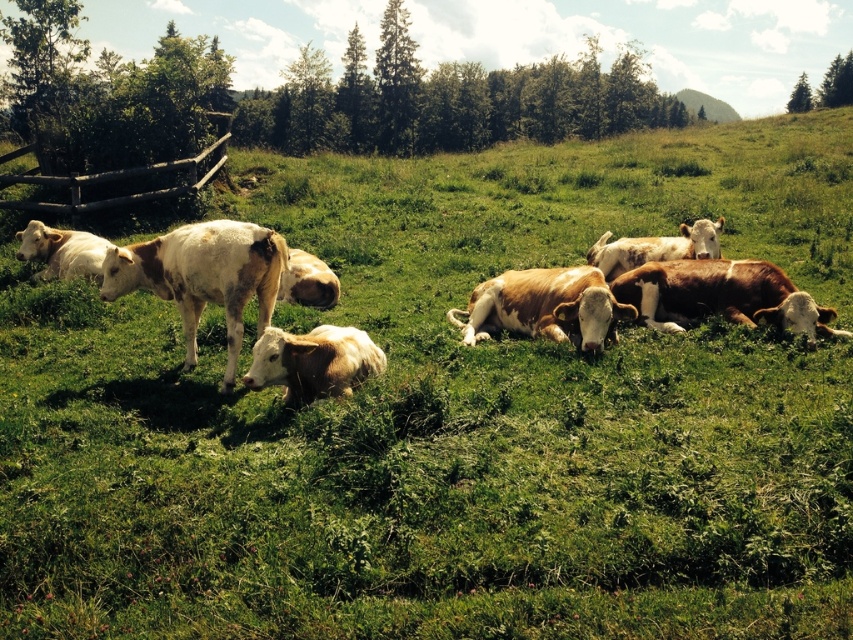
Question: Does brown speckled cow at center lie in front of brown wooden fence at left?

Choices:
 (A) yes
 (B) no

Answer: (A)

Question: Is brown speckled cow at center to the right of brown wooden fence at left from the viewer's perspective?

Choices:
 (A) no
 (B) yes

Answer: (B)

Question: Is brown speckled cow at center wider than brown wooden fence at left?

Choices:
 (A) no
 (B) yes

Answer: (A)